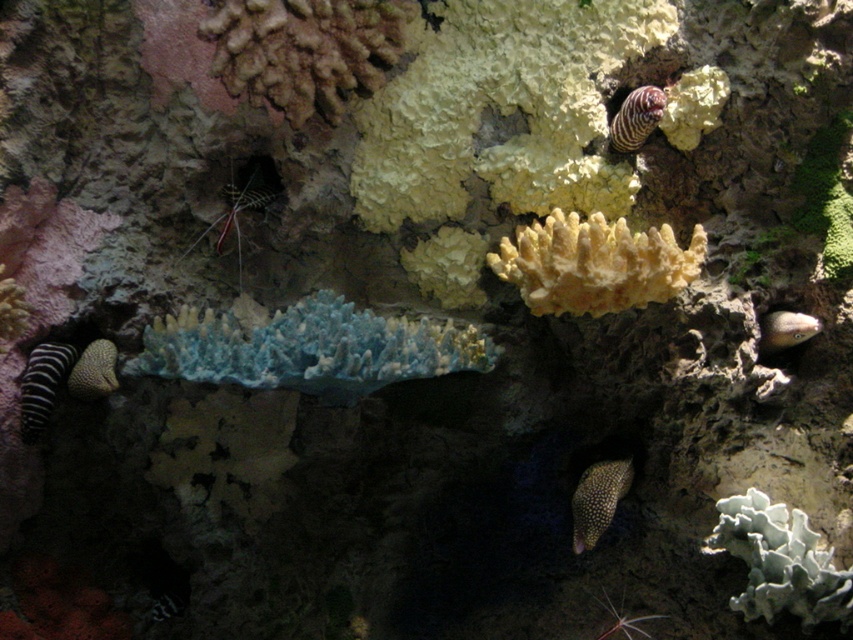
Who is more forward, (21, 428) or (91, 387)?

Point (91, 387) is in front.

How far apart are black striped fish at lower left and speckled gray fish at lower left?

black striped fish at lower left and speckled gray fish at lower left are 4.67 centimeters apart from each other.

At what (x,y) coordinates should I click in order to perform the action: click on black striped fish at lower left. Please return your answer as a coordinate pair (x, y). The image size is (853, 640). Looking at the image, I should click on (x=42, y=385).

You are a GUI agent. You are given a task and a screenshot of the screen. Output one action in this format:
    pyautogui.click(x=<x>, y=<y>)
    Task: Click on the black striped fish at lower left
    This screenshot has width=853, height=640.
    Given the screenshot: What is the action you would take?
    (x=42, y=385)

Can you confirm if zebra-striped eel at upper right is taller than speckled gray fish at lower left?

Correct, zebra-striped eel at upper right is much taller as speckled gray fish at lower left.

Who is more distant from viewer, (x=614, y=116) or (x=102, y=340)?

Point (x=102, y=340)

Does point (631, 140) lie behind point (83, 362)?

Yes.

The width and height of the screenshot is (853, 640). Identify the location of zebra-striped eel at upper right. (635, 118).

Does point (494, 257) lie behind point (22, 372)?

Yes, point (494, 257) is behind point (22, 372).

Describe the element at coordinates (595, 262) in the screenshot. The image size is (853, 640). I see `yellow matte coral at center` at that location.

Where is `yellow matte coral at center`? yellow matte coral at center is located at coordinates (595, 262).